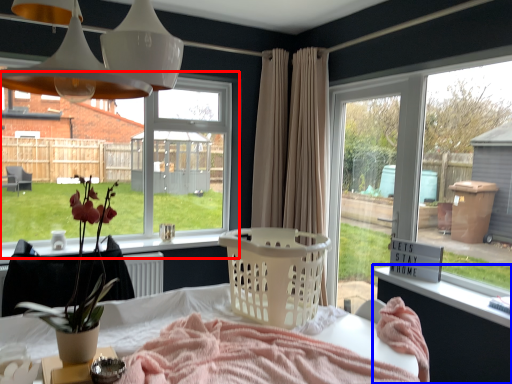
Question: Which object appears closest to the camera in this image, window (highlighted by a red box) or changing table (highlighted by a blue box)?

Choices:
 (A) window
 (B) changing table

Answer: (B)